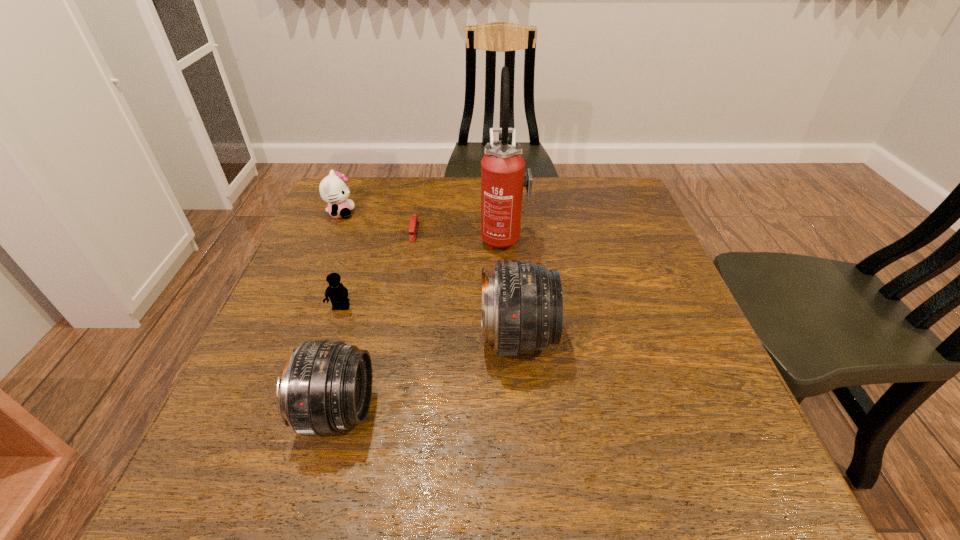
The width and height of the screenshot is (960, 540). What are the coordinates of `empty space between the left telephoto lens and the leftmost object` in the screenshot? It's located at (339, 312).

At what (x,y) coordinates should I click in order to perform the action: click on vacant area that lies between the left telephoto lens and the fourth tallest object. Please return your answer as a coordinate pair (x, y). The image size is (960, 540). Looking at the image, I should click on (339, 312).

Where is `empty location between the Lego and the leftmost object`? This screenshot has height=540, width=960. empty location between the Lego and the leftmost object is located at coordinates (341, 261).

Where is `object that is the fifth closest one to the tallest object`? object that is the fifth closest one to the tallest object is located at coordinates [326, 386].

Find the location of a particular element. This screenshot has width=960, height=540. object that is the fifth closest to the taller telephoto lens is located at coordinates (333, 189).